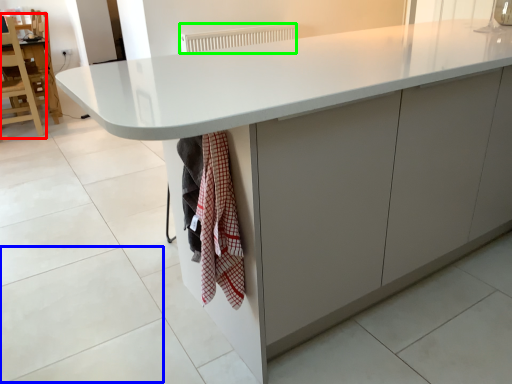
Question: Which object is positioned closest to chair (highlighted by a red box)? Select from granite (highlighted by a blue box) and radiator (highlighted by a green box).

Choices:
 (A) granite
 (B) radiator

Answer: (B)